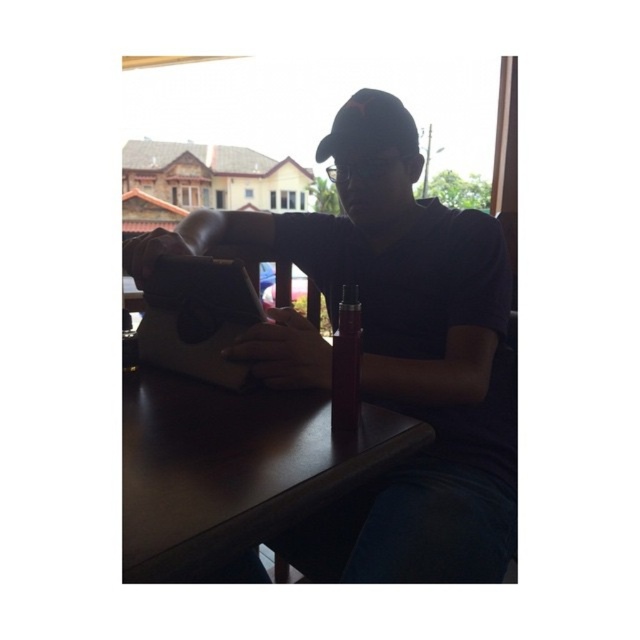
Question: Is matte black laptop at center closer to the viewer compared to dark wood table at center?

Choices:
 (A) yes
 (B) no

Answer: (B)

Question: Which of the following is the farthest from the observer?

Choices:
 (A) matte black laptop at center
 (B) dark wood table at center

Answer: (A)

Question: Is matte black laptop at center to the left of dark wood table at center from the viewer's perspective?

Choices:
 (A) no
 (B) yes

Answer: (A)

Question: Among these objects, which one is nearest to the camera?

Choices:
 (A) dark wood table at center
 (B) matte black laptop at center

Answer: (A)

Question: Does matte black laptop at center appear on the right side of dark wood table at center?

Choices:
 (A) yes
 (B) no

Answer: (A)